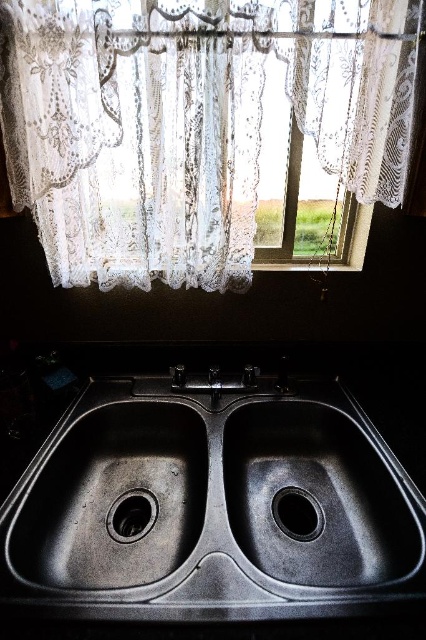
Which is below, white lace curtain at upper center or black rubber drain at bottom center?

black rubber drain at bottom center is below.

Which is behind, point (123, 22) or point (290, 508)?

Positioned behind is point (290, 508).

Measure the distance between white lace curtain at upper center and camera.

white lace curtain at upper center is 35.88 inches from camera.

I want to click on white lace curtain at upper center, so [189, 124].

Does black matte sink at center have a larger size compared to black rubber drain at center?

Yes.

Is point (267, 445) more distant than point (152, 518)?

Yes, it is behind point (152, 518).

Between point (221, 392) and point (138, 531), which one is positioned behind?

Point (221, 392)

Locate an element on the screen. The width and height of the screenshot is (426, 640). black matte sink at center is located at coordinates (212, 504).

Locate an element on the screen. This screenshot has height=640, width=426. white lace curtain at upper center is located at coordinates (189, 124).

Can you confirm if white lace curtain at upper center is bigger than black matte sink at center?

Incorrect, white lace curtain at upper center is not larger than black matte sink at center.

At what (x,y) coordinates should I click in order to perform the action: click on white lace curtain at upper center. Please return your answer as a coordinate pair (x, y). This screenshot has height=640, width=426. Looking at the image, I should click on (189, 124).